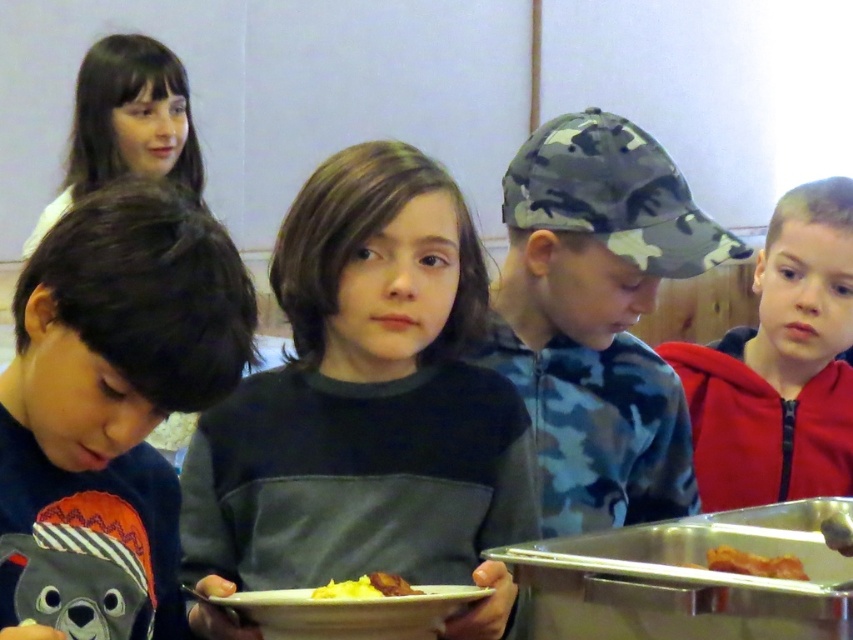
Question: Can you confirm if dark gray cotton shirt at center is positioned below camo fabric cap at center?

Choices:
 (A) yes
 (B) no

Answer: (A)

Question: Which point appears farthest from the camera in this image?

Choices:
 (A) (799, 260)
 (B) (57, 394)

Answer: (A)

Question: Does golden crispy bacon at lower right have a smaller size compared to yellow matte scrambled eggs at center?

Choices:
 (A) no
 (B) yes

Answer: (B)

Question: Considering the real-world distances, which object is closest to the golden crispy bacon at lower right?

Choices:
 (A) dark gray cotton shirt at center
 (B) red fleece jacket at right
 (C) yellow matte scrambled eggs at center

Answer: (C)

Question: Can you confirm if dark gray cotton shirt at center is thinner than yellow matte scrambled eggs at center?

Choices:
 (A) no
 (B) yes

Answer: (A)

Question: Which object is positioned closest to the dark gray cotton shirt at center?

Choices:
 (A) golden crispy bacon at lower right
 (B) red fleece jacket at right

Answer: (A)